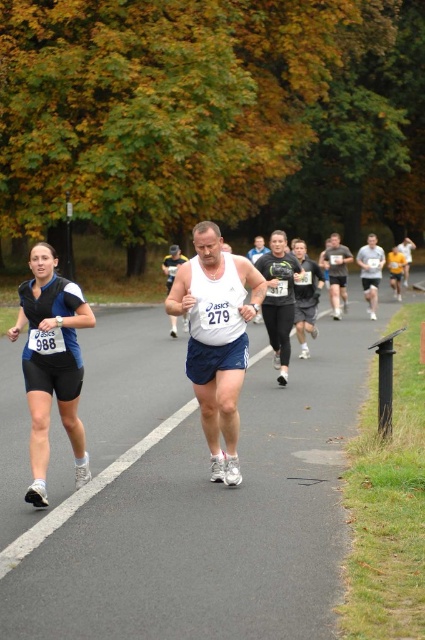
Question: Can you confirm if matte blue shorts at left is positioned to the right of white tank top at center?

Choices:
 (A) no
 (B) yes

Answer: (B)

Question: Is white mesh tank top at center smaller than white tank top at center?

Choices:
 (A) yes
 (B) no

Answer: (A)

Question: Does matte black shorts at center appear under white tank top at center?

Choices:
 (A) no
 (B) yes

Answer: (B)

Question: Which point appears closest to the camera in this image?

Choices:
 (A) (175, 252)
 (B) (283, 305)

Answer: (B)

Question: Which point is farther to the camera?

Choices:
 (A) matte black shorts at center
 (B) dark gray running shorts at center
 (C) white matte tank top at center
 (D) white fabric shirt at center

Answer: (B)

Question: Which point appears closest to the camera in this image?

Choices:
 (A) (306, 288)
 (B) (82, 461)
 (C) (370, 246)

Answer: (B)